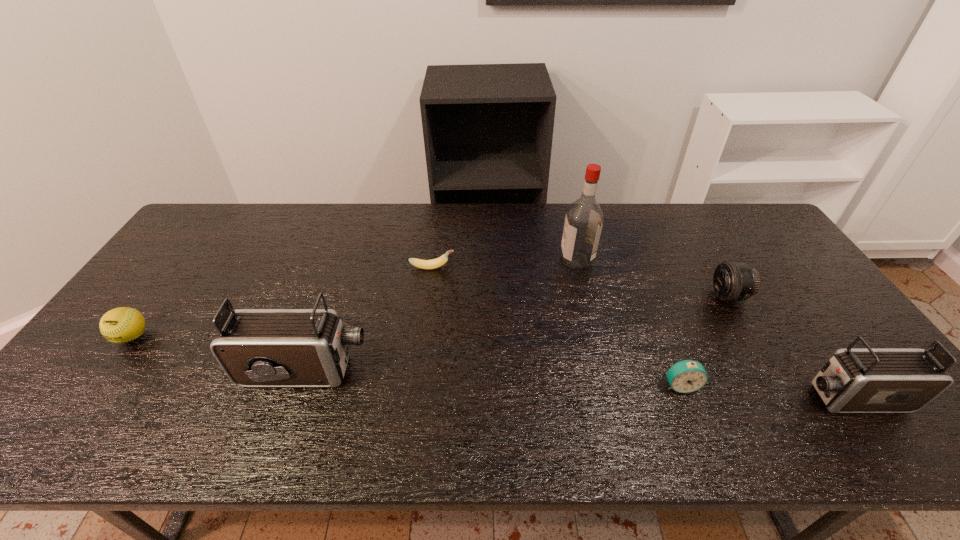
Locate an element on the screen. the taller camcorder is located at coordinates (255, 347).

Where is `the second object from left to right`? the second object from left to right is located at coordinates (255, 347).

This screenshot has height=540, width=960. In order to click on the right camcorder in this screenshot , I will do `click(868, 380)`.

Where is `the shorter camcorder`? the shorter camcorder is located at coordinates (868, 380).

In order to click on the fourth shortest object in this screenshot , I will do `click(732, 281)`.

Find the location of a particular element. telephoto lens is located at coordinates (732, 281).

Locate an element on the screen. The width and height of the screenshot is (960, 540). the tallest object is located at coordinates (584, 219).

At what (x,y) coordinates should I click in order to perform the action: click on liquor. Please return your answer as a coordinate pair (x, y). The width and height of the screenshot is (960, 540). Looking at the image, I should click on (584, 219).

At what (x,y) coordinates should I click in order to perform the action: click on the shortest object. Please return your answer as a coordinate pair (x, y). This screenshot has height=540, width=960. Looking at the image, I should click on (438, 262).

The height and width of the screenshot is (540, 960). Identify the location of banana. (438, 262).